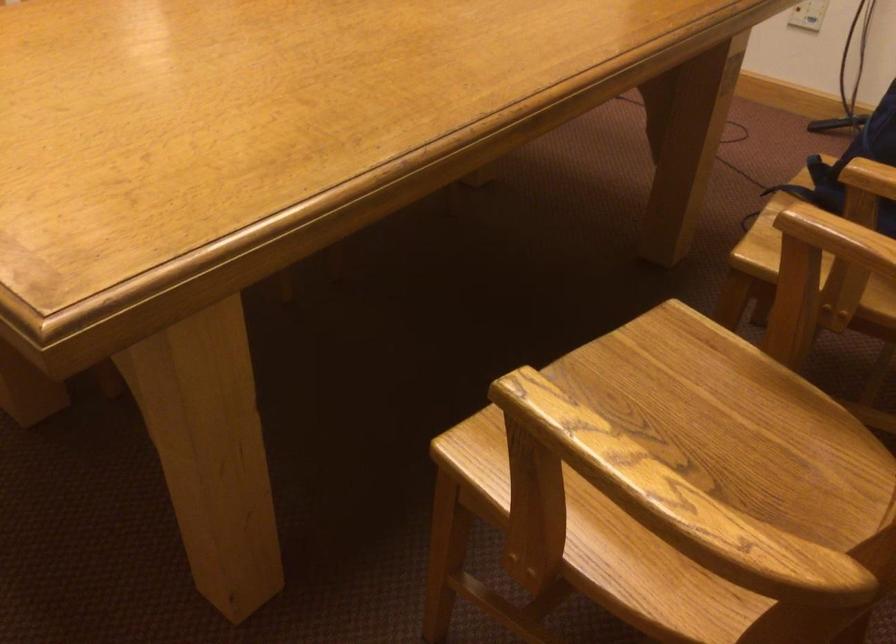
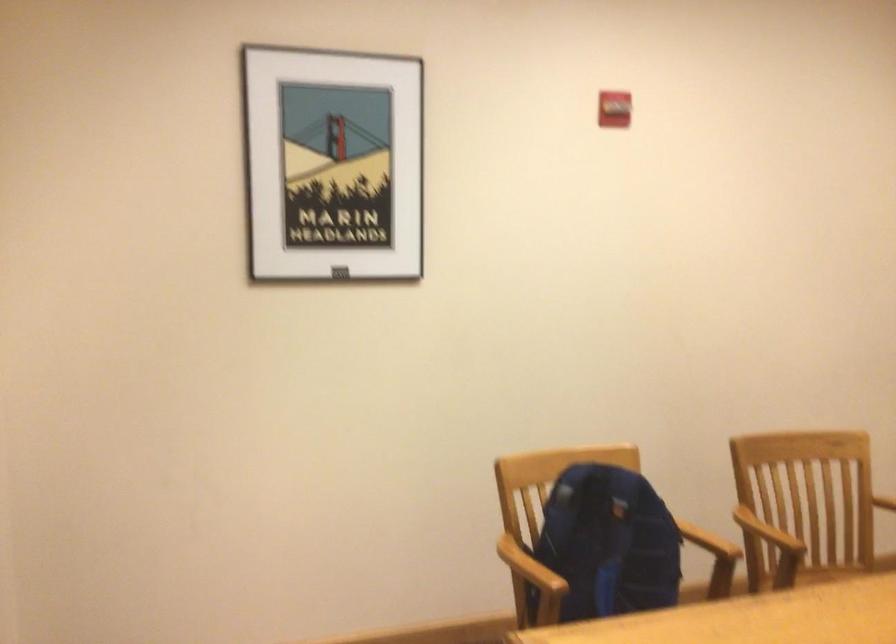
Question: I am providing you with two images of the same scene from different viewpoints. Please identify which objects are invisible in image2.

Choices:
 (A) chair sitting surface
 (B) blue backpack
 (C) wooden chair armrest
 (D) none of these

Answer: (D)